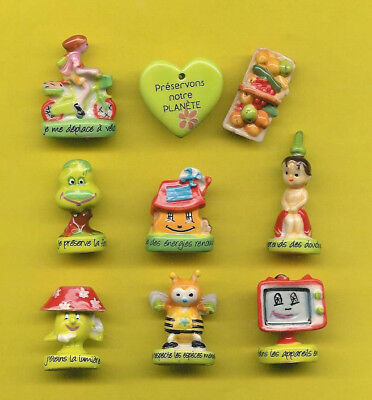
Where is `trinkets`? trinkets is located at coordinates point(65,97), point(165,96), point(237,101), point(286,202), point(191,223), point(86,214), point(78,313), point(188,326), point(284,312).